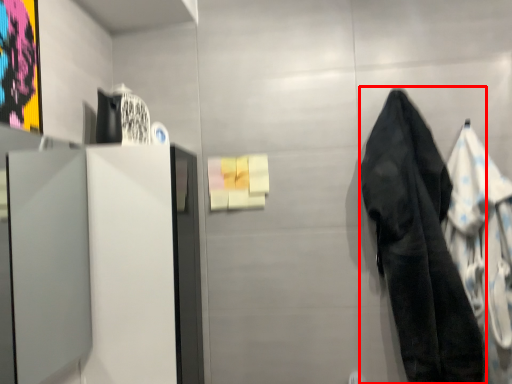
Question: In this image, where is towel/napkin (annotated by the red box) located relative to cloak?

Choices:
 (A) right
 (B) left

Answer: (B)